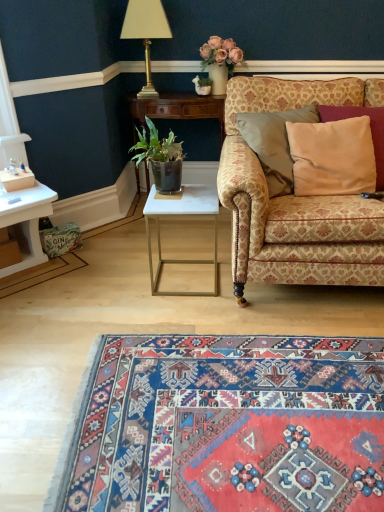
Where is `free space to the left of patterned fabric couch at right`? This screenshot has height=512, width=384. free space to the left of patterned fabric couch at right is located at coordinates coord(136,280).